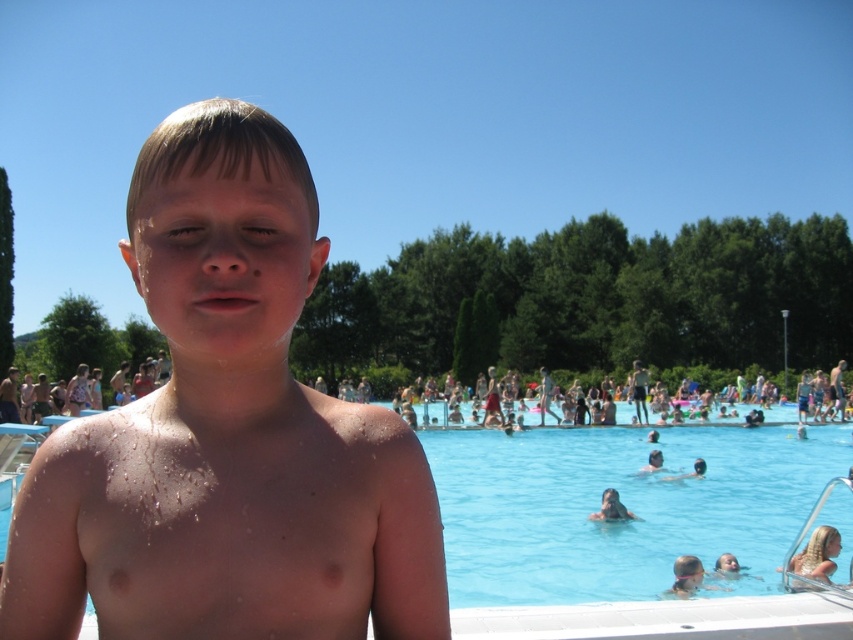
Consider the image. You are standing at the edge of the pool and want to reach the point marked as point (775, 625). However, there is an obstacle at point (614, 493). Can you safely swim around the obstacle to reach your destination?

Yes, you can safely swim around the obstacle because point (775, 625) is in front of point (614, 493), meaning the obstacle is behind your path to the destination.

You are a lifeguard standing at the edge of the pool. You notice a point at coordinates (631, 529) in the image. What does this point correspond to?

The point at coordinates (631, 529) corresponds to the blue smooth water at center.